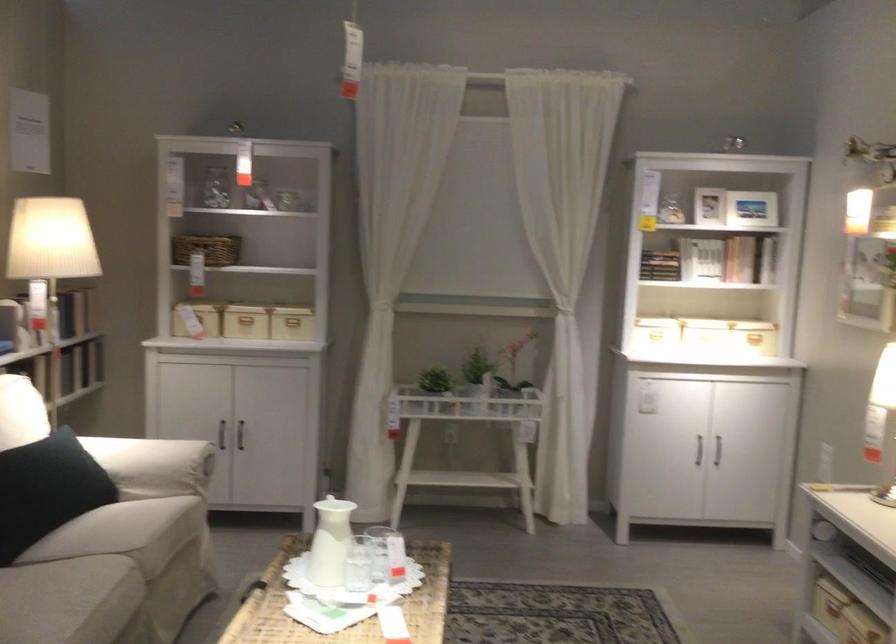
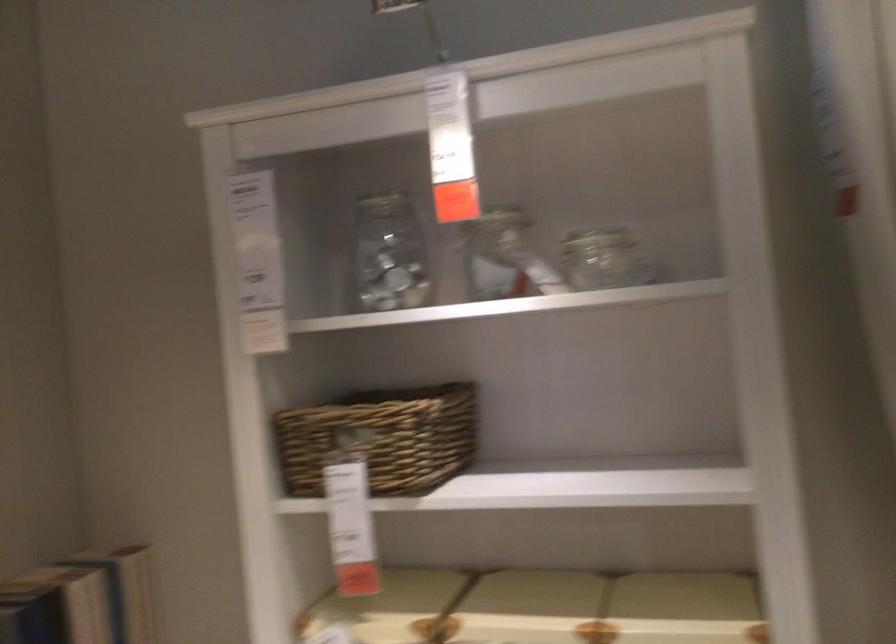
The point at (306, 185) is marked in the first image. Where is the corresponding point in the second image?

(597, 238)